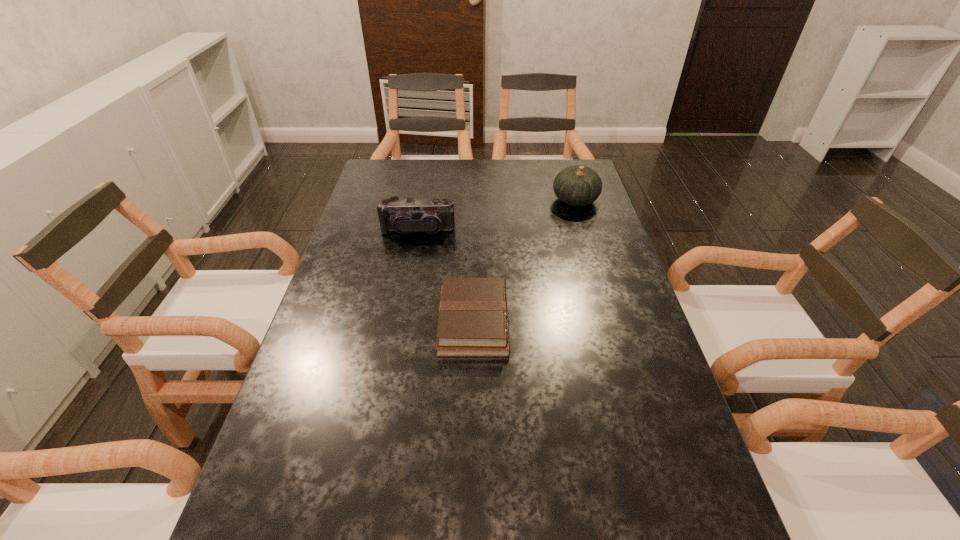
Find the location of `object that is positioned at the left edge`. object that is positioned at the left edge is located at coordinates [x=409, y=215].

Identify the location of object that is at the right edge. (577, 185).

In order to click on object present at the far right corner in this screenshot , I will do `click(577, 185)`.

Where is `free spot at the far edge of the desktop`? This screenshot has width=960, height=540. free spot at the far edge of the desktop is located at coordinates (440, 182).

I want to click on vacant region at the left edge of the desktop, so click(333, 356).

Locate an element on the screen. free region at the right edge is located at coordinates (611, 256).

Find the location of a particular element. The height and width of the screenshot is (540, 960). free space at the far left corner of the desktop is located at coordinates (399, 165).

Where is `vacant point located between the nearest object and the camcorder`? vacant point located between the nearest object and the camcorder is located at coordinates (445, 276).

You are a GUI agent. You are given a task and a screenshot of the screen. Output one action in this format:
    pyautogui.click(x=<x>, y=<y>)
    Task: Click on the empty space that is in between the farthest object and the camcorder
    The width and height of the screenshot is (960, 540).
    Given the screenshot: What is the action you would take?
    pyautogui.click(x=496, y=215)

Identify the location of free spot between the shortest object and the second farthest object. (445, 276).